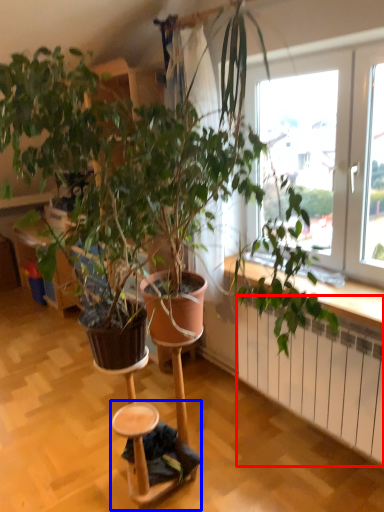
Question: Which point is further to the camera, radiator (highlighted by a red box) or step stool (highlighted by a blue box)?

Choices:
 (A) radiator
 (B) step stool

Answer: (B)